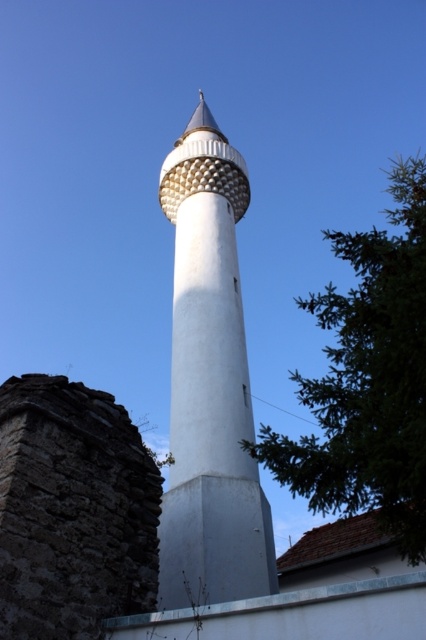
Question: Can you confirm if white smooth minaret at center is smaller than green leafy tree at center right?

Choices:
 (A) yes
 (B) no

Answer: (A)

Question: Which point is farther to the camera?

Choices:
 (A) (244, 428)
 (B) (397, 326)

Answer: (A)

Question: Does white smooth minaret at center appear over green leafy tree at center right?

Choices:
 (A) no
 (B) yes

Answer: (B)

Question: Which object is closer to the camera taking this photo?

Choices:
 (A) white smooth minaret at center
 (B) green leafy tree at center right

Answer: (B)

Question: Can you confirm if white smooth minaret at center is thinner than green leafy tree at center right?

Choices:
 (A) yes
 (B) no

Answer: (A)

Question: Which of the following is the closest to the observer?

Choices:
 (A) white smooth minaret at center
 (B) green leafy tree at center right

Answer: (B)